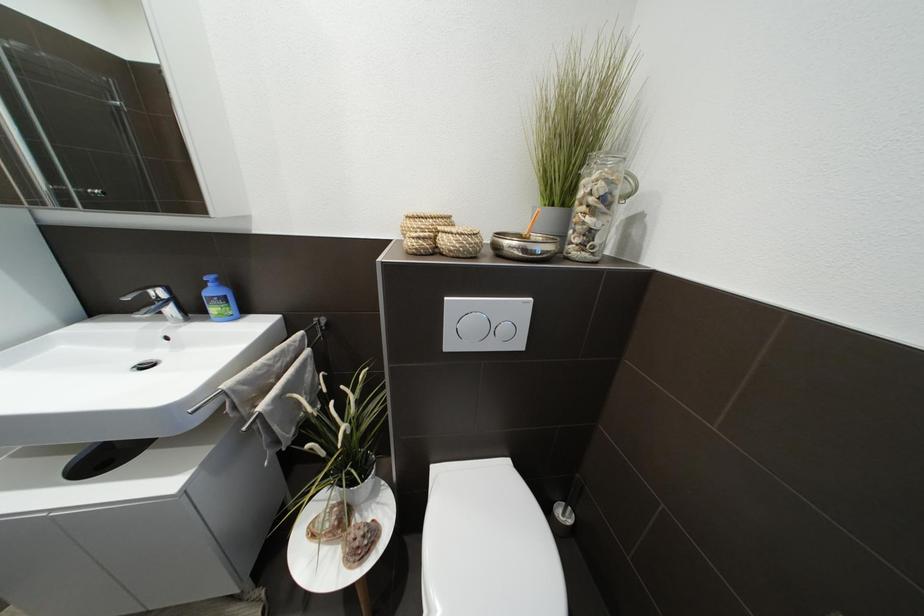
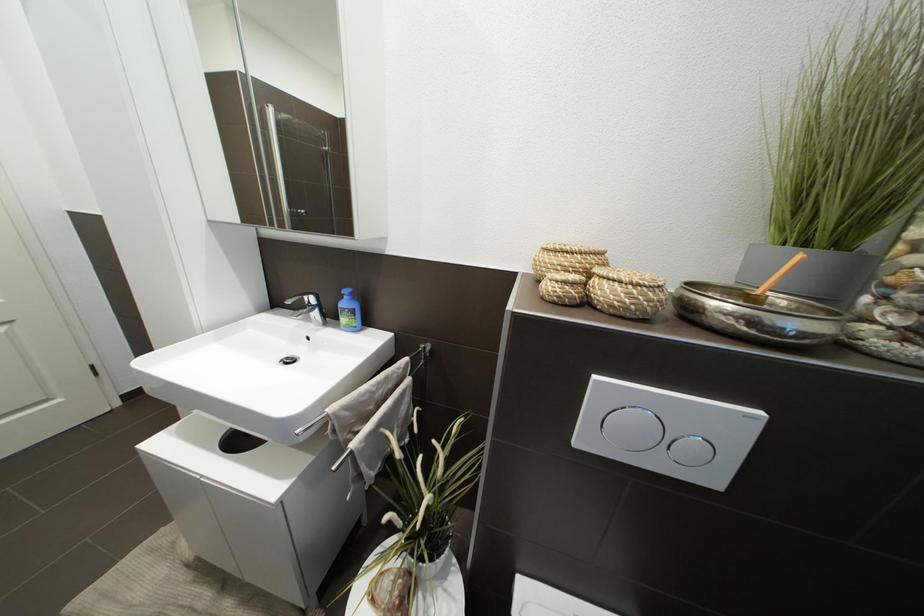
Question: Based on the continuous images, in which direction is the camera rotating? Reply with the corresponding letter.

Choices:
 (A) Left
 (B) Right
 (C) Up
 (D) Down

Answer: (A)